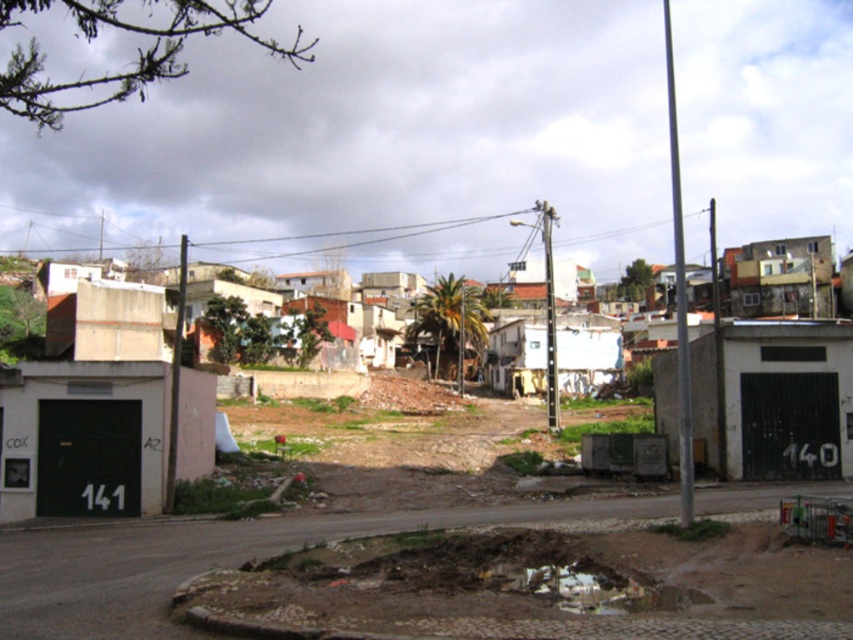
You are navigating a drone through the urban scene described. You must fly from point A to point B. Given that point A is at coordinates point (387,420) and point B is at point (788,259), which point is closer to the camera based on their positions?

Point (387,420) is closer to the camera since it is in front of point (788,259).

Consider the image. You are navigating a drone over an urban area shown in the image. You need to land the drone on the brown soil at center. Based on the coordinates provided, can you confirm if the point marked at (x=421, y=428) is indeed the correct location for landing?

The point at (x=421, y=428) corresponds to the brown soil at center, so yes, this is the correct location for landing the drone.